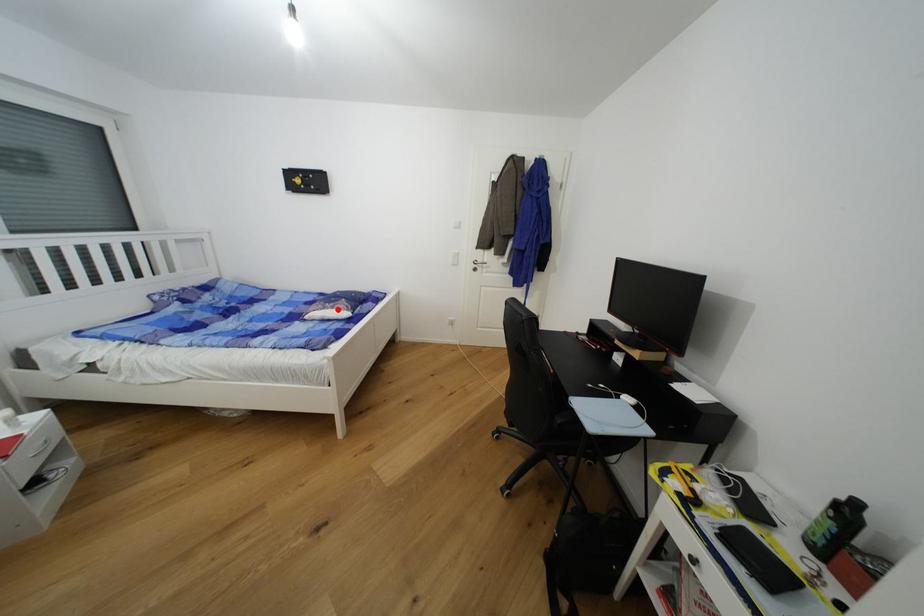
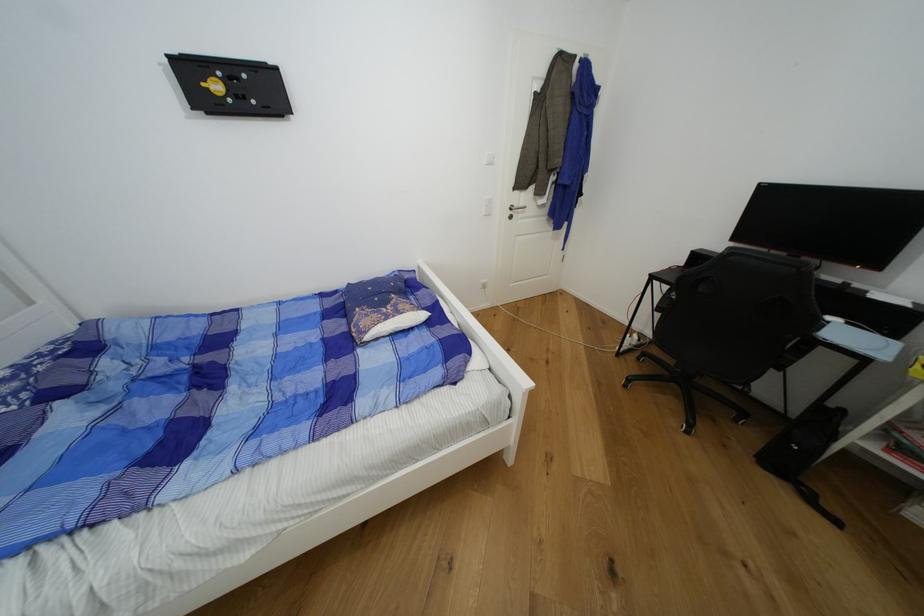
Find the pixel in the second image that matches the highlighted location in the first image.

(404, 314)